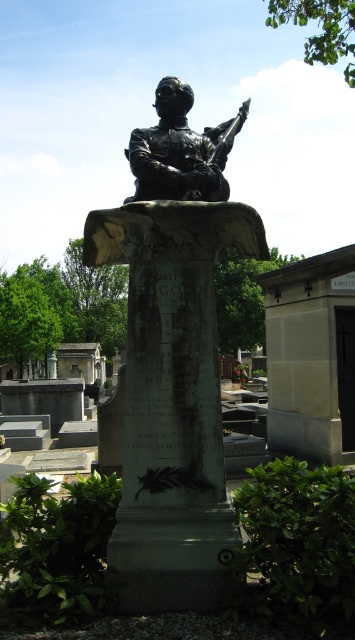
Is point (151, 198) behind point (221, 154)?

No, (151, 198) is closer to viewer.

You are a GUI agent. You are given a task and a screenshot of the screen. Output one action in this format:
    pyautogui.click(x=<x>, y=<y>)
    Task: Click on the black polished statue at center
    
    Given the screenshot: What is the action you would take?
    pyautogui.click(x=172, y=358)